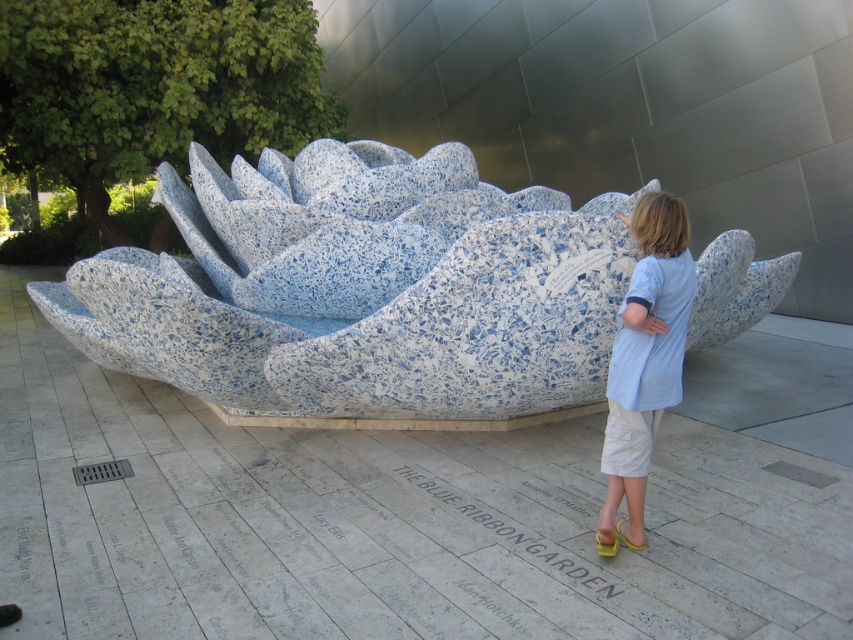
You are standing in front of a public sculpture and want to take a photo of the speckled stone lotus at center. If you are exactly 10.42 feet away from it, will you be able to capture the entire sculpture in your camera frame?

Yes, since you are exactly 10.42 feet away from the speckled stone lotus at center, which is the required distance to capture the entire sculpture in your camera frame.

You are a photographer trying to capture a photo of the speckled stone lotus at center without the light blue cotton shirt at center appearing in the frame. Given that the distance between them is 6.03 feet, what is the minimum distance you need to move backward to ensure the shirt is out of the shot?

The minimum distance you need to move backward is 6.03 feet to ensure the light blue cotton shirt at center does not appear in the frame with the speckled stone lotus at center.